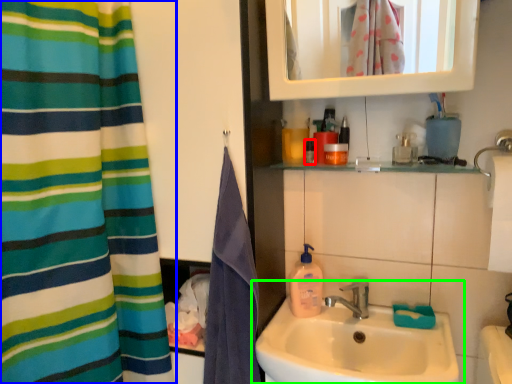
Question: Based on their relative distances, which object is nearer to mouthwash (highlighted by a red box)? Choose from curtain (highlighted by a blue box) and sink (highlighted by a green box).

Choices:
 (A) curtain
 (B) sink

Answer: (B)